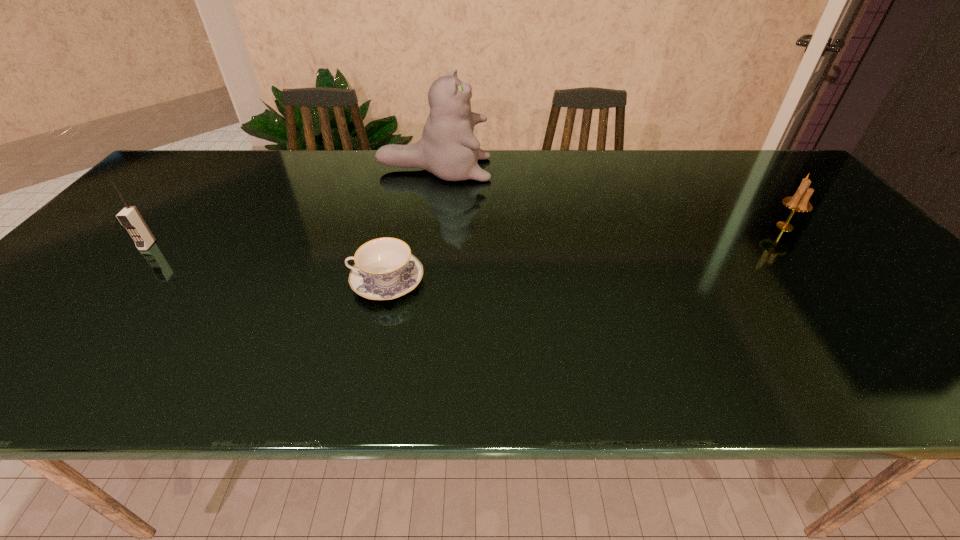
At what (x,y) coordinates should I click in order to perform the action: click on the farthest object. Please return your answer as a coordinate pair (x, y). Looking at the image, I should click on (448, 148).

At what (x,y) coordinates should I click in order to perform the action: click on the tallest object. Please return your answer as a coordinate pair (x, y). Looking at the image, I should click on (448, 148).

Where is `cellular telephone`? cellular telephone is located at coordinates click(129, 217).

Find the location of a particular element. the second nearest object is located at coordinates (129, 217).

Image resolution: width=960 pixels, height=540 pixels. What are the coordinates of `the third nearest object` in the screenshot? It's located at (798, 202).

This screenshot has height=540, width=960. I want to click on the rightmost object, so click(x=798, y=202).

Where is `the nearest object`? This screenshot has width=960, height=540. the nearest object is located at coordinates (385, 269).

This screenshot has height=540, width=960. In order to click on the shortest object in this screenshot , I will do `click(385, 269)`.

Locate an element on the screen. vacant space situated 0.220m on the face of the farthest object is located at coordinates (561, 170).

The image size is (960, 540). I want to click on vacant space located 0.170m on the front-facing side of the leftmost object, so click(100, 300).